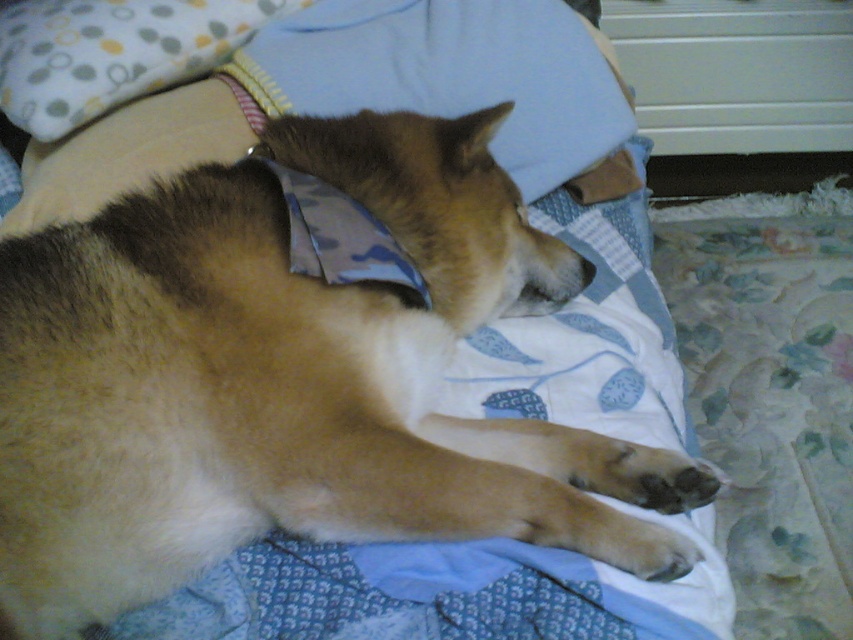
Does brown fur dog at center lie in front of soft cotton pillow at upper left?

Yes, brown fur dog at center is closer to the viewer.

Is point (259, 406) positioned behind point (0, 26)?

No.

Who is more distant from viewer, (x=102, y=474) or (x=149, y=68)?

The point (x=149, y=68) is behind.

The height and width of the screenshot is (640, 853). Identify the location of brown fur dog at center. (289, 380).